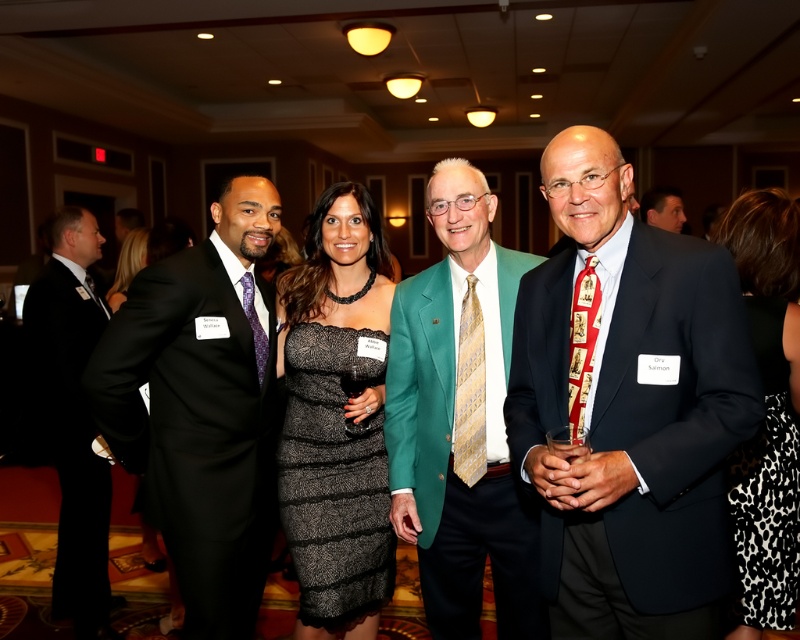
You are at a formal event and need to locate the black sequined dress at center and the black suit at left. Based on their positions, which one is positioned higher in the image?

The black sequined dress at center is located above the black suit at left, so it is positioned higher in the image.

You are a photographer at the event and want to capture a photo of the black sequined dress at center without the black suit at left appearing in the background. Is the current arrangement suitable for this?

The black sequined dress at center is in front of the black suit at left, so the black suit at left will be behind the black sequined dress at center in the photo. Therefore, the current arrangement is suitable for capturing the black sequined dress at center without the black suit at left in the background.